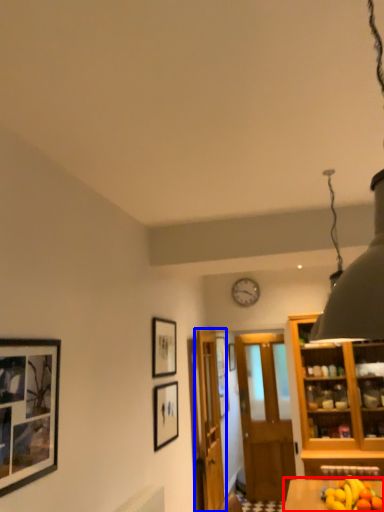
Question: Among these objects, which one is nearest to the camera, table (highlighted by a red box) or door (highlighted by a blue box)?

Choices:
 (A) table
 (B) door

Answer: (A)